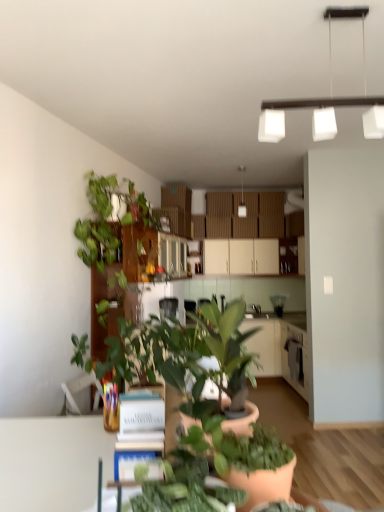
Question: Considering the relative sizes of green matte plant at center, arranged as the second houseplant when viewed from the back, and green matte plant at center, which is the 1th houseplant from right to left, in the image provided, is green matte plant at center, arranged as the second houseplant when viewed from the back, thinner than green matte plant at center, which is the 1th houseplant from right to left,?

Choices:
 (A) yes
 (B) no

Answer: (B)

Question: From a real-world perspective, is green matte plant at center, which is the 2th houseplant from front to back, positioned under green matte plant at center, positioned as the 3th houseplant in left-to-right order, based on gravity?

Choices:
 (A) yes
 (B) no

Answer: (B)

Question: Can you confirm if green matte plant at center, the second houseplant viewed from the right, is positioned to the right of green matte plant at center, which is counted as the 1th houseplant, starting from the front?

Choices:
 (A) no
 (B) yes

Answer: (A)

Question: Does green matte plant at center, which is the 2th houseplant from front to back, have a smaller size compared to green matte plant at center, the 3th houseplant when ordered from back to front?

Choices:
 (A) yes
 (B) no

Answer: (B)

Question: Considering the relative positions of green matte plant at center, the second houseplant viewed from the right, and green matte plant at center, which is the 1th houseplant from right to left, in the image provided, is green matte plant at center, the second houseplant viewed from the right, to the left of green matte plant at center, which is the 1th houseplant from right to left, from the viewer's perspective?

Choices:
 (A) no
 (B) yes

Answer: (B)

Question: From a real-world perspective, is white matte cabinet at center positioned above or below green matte plant at center, which is counted as the 1th houseplant, starting from the front?

Choices:
 (A) below
 (B) above

Answer: (B)

Question: Relative to green matte plant at center, which is the 1th houseplant from right to left, is white matte cabinet at center in front or behind?

Choices:
 (A) behind
 (B) front

Answer: (A)

Question: Based on their sizes in the image, would you say white matte cabinet at center is bigger or smaller than green matte plant at center, the 3th houseplant when ordered from back to front?

Choices:
 (A) big
 (B) small

Answer: (A)

Question: From the image's perspective, is white matte cabinet at center positioned above or below green matte plant at center, which is counted as the 1th houseplant, starting from the front?

Choices:
 (A) below
 (B) above

Answer: (B)

Question: From a real-world perspective, is white matte cabinet at center above or below green leafy plant at left, which ranks as the 1th houseplant in back-to-front order?

Choices:
 (A) above
 (B) below

Answer: (B)

Question: From the image's perspective, relative to green leafy plant at left, which is the third houseplant from right to left, is white matte cabinet at center above or below?

Choices:
 (A) below
 (B) above

Answer: (A)

Question: Would you say white matte cabinet at center is inside or outside green leafy plant at left, placed as the first houseplant when sorted from left to right?

Choices:
 (A) outside
 (B) inside

Answer: (A)

Question: Is point (221, 241) positioned closer to the camera than point (127, 203)?

Choices:
 (A) farther
 (B) closer

Answer: (A)

Question: Relative to white matte book at center, is green leafy plant at left, placed as the third houseplant when sorted from front to back, in front or behind?

Choices:
 (A) behind
 (B) front

Answer: (A)

Question: From the image's perspective, relative to white matte book at center, is green leafy plant at left, placed as the third houseplant when sorted from front to back, above or below?

Choices:
 (A) above
 (B) below

Answer: (A)